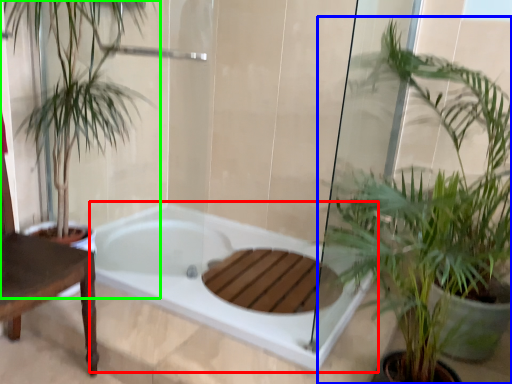
Question: Which is nearer to the bathtub (highlighted by a red box)? houseplant (highlighted by a blue box) or houseplant (highlighted by a green box).

Choices:
 (A) houseplant
 (B) houseplant

Answer: (B)